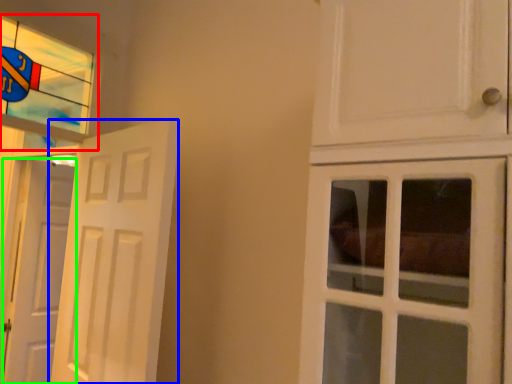
Question: Considering the real-world distances, which object is farthest from window (highlighted by a red box)? door (highlighted by a blue box) or door (highlighted by a green box)?

Choices:
 (A) door
 (B) door

Answer: (B)